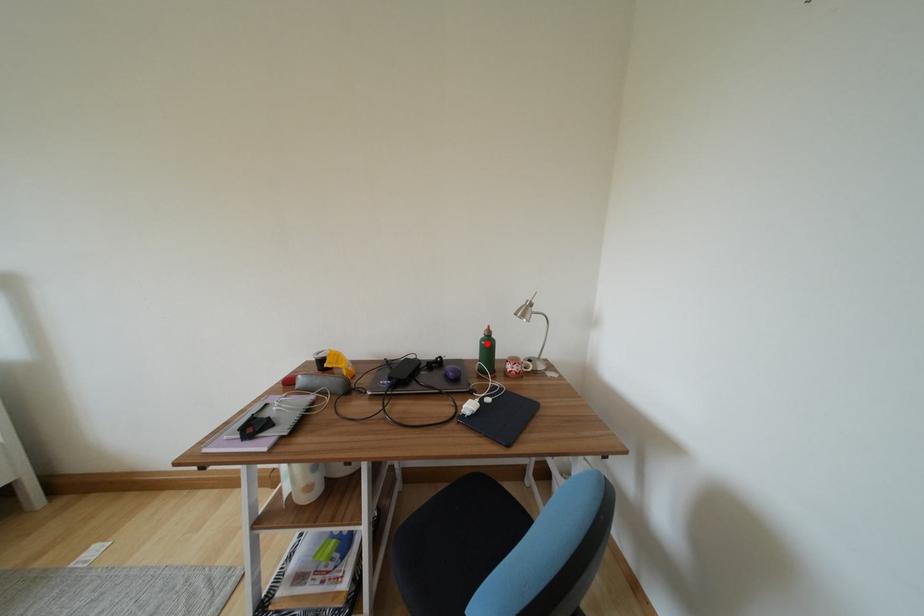
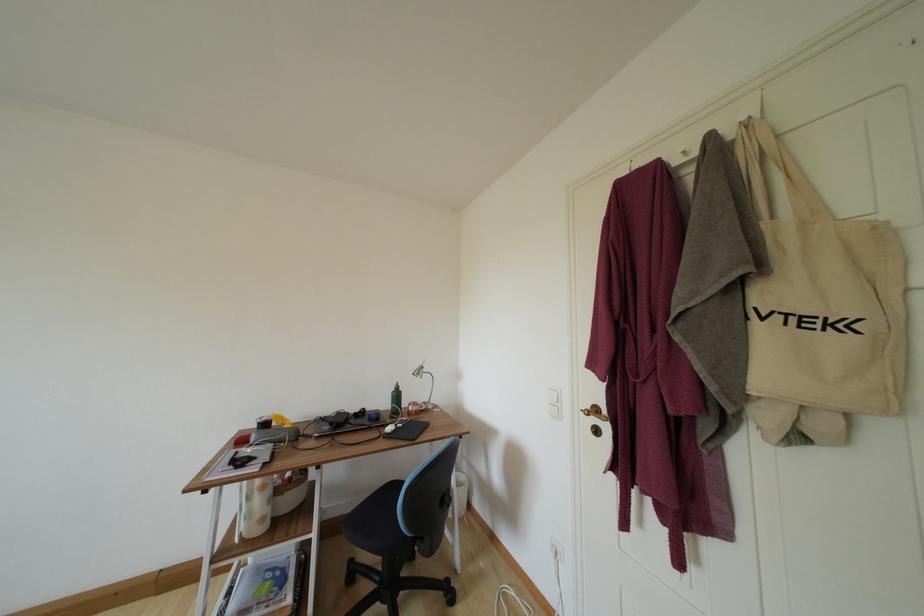
Question: I am providing you with two images of the same scene from different viewpoints. In image1, a red point is highlighted. Considering the same 3D point in image2, which of the following is correct?

Choices:
 (A) It is closer
 (B) It is farther

Answer: (B)